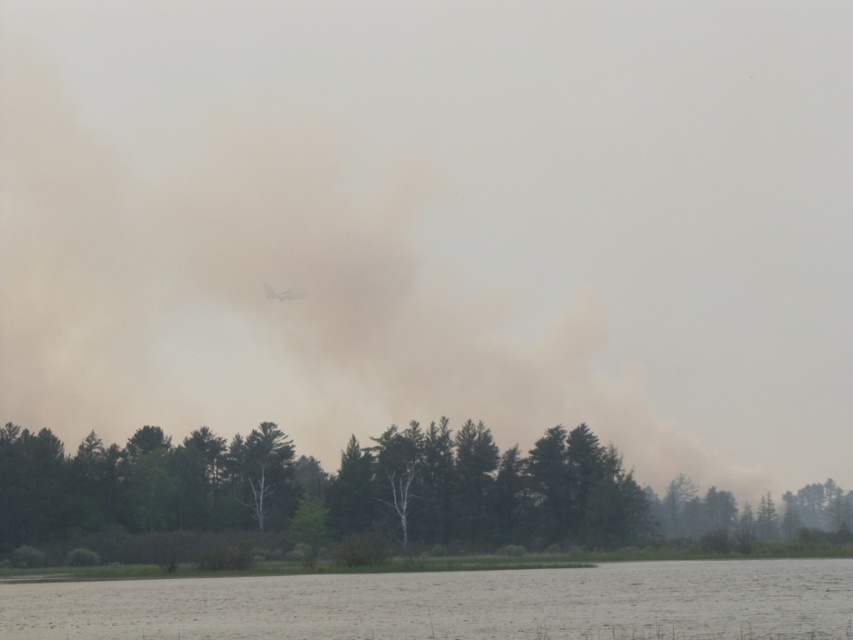
Question: Which point is farther from the camera taking this photo?

Choices:
 (A) (676, 621)
 (B) (70, 468)

Answer: (B)

Question: From the image, what is the correct spatial relationship of green matte tree at center in relation to gray matte water at lower center?

Choices:
 (A) below
 (B) above

Answer: (A)

Question: Does green matte tree at center have a lesser width compared to gray matte water at lower center?

Choices:
 (A) no
 (B) yes

Answer: (A)

Question: Is green matte tree at center further to the viewer compared to gray matte water at lower center?

Choices:
 (A) yes
 (B) no

Answer: (A)

Question: Among these objects, which one is farthest from the camera?

Choices:
 (A) green matte tree at center
 (B) gray matte water at lower center

Answer: (A)

Question: Which point is farther to the camera?

Choices:
 (A) (450, 440)
 (B) (383, 625)

Answer: (A)